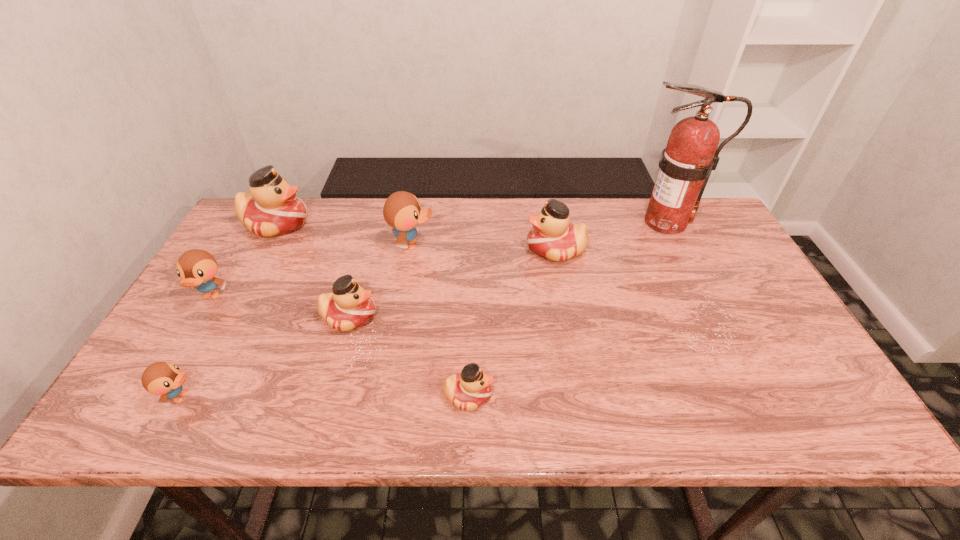
At what (x,y) coordinates should I click in order to perform the action: click on free spot located 0.290m on the face of the rightmost duck. Please return your answer as a coordinate pair (x, y). This screenshot has width=960, height=540. Looking at the image, I should click on (428, 249).

You are a GUI agent. You are given a task and a screenshot of the screen. Output one action in this format:
    pyautogui.click(x=<x>, y=<y>)
    Task: Click on the free space located on the front-facing side of the second biggest blue duck
    
    Given the screenshot: What is the action you would take?
    pyautogui.click(x=156, y=387)

Locate an element on the screen. The width and height of the screenshot is (960, 540). free space located 0.080m on the face of the second smallest red duck is located at coordinates (409, 316).

At what (x,y) coordinates should I click in order to perform the action: click on free space located on the front-facing side of the smallest blue duck. Please return your answer as a coordinate pair (x, y). The image size is (960, 540). Looking at the image, I should click on point(260,397).

Where is `vacant position located 0.240m on the face of the second red duck from right to left`? The image size is (960, 540). vacant position located 0.240m on the face of the second red duck from right to left is located at coordinates (603, 395).

Find the location of a particular element. Image resolution: width=960 pixels, height=540 pixels. fire extinguisher that is positioned at the far edge is located at coordinates (691, 154).

Locate an element on the screen. This screenshot has height=540, width=960. object located at the right edge is located at coordinates (691, 154).

At what (x,y) coordinates should I click in order to perform the action: click on object located at the far left corner. Please return your answer as a coordinate pair (x, y). The width and height of the screenshot is (960, 540). Looking at the image, I should click on (272, 208).

This screenshot has width=960, height=540. Identify the location of object that is at the near left corner. click(161, 378).

The height and width of the screenshot is (540, 960). Find the location of `object at the far right corner`. object at the far right corner is located at coordinates (691, 154).